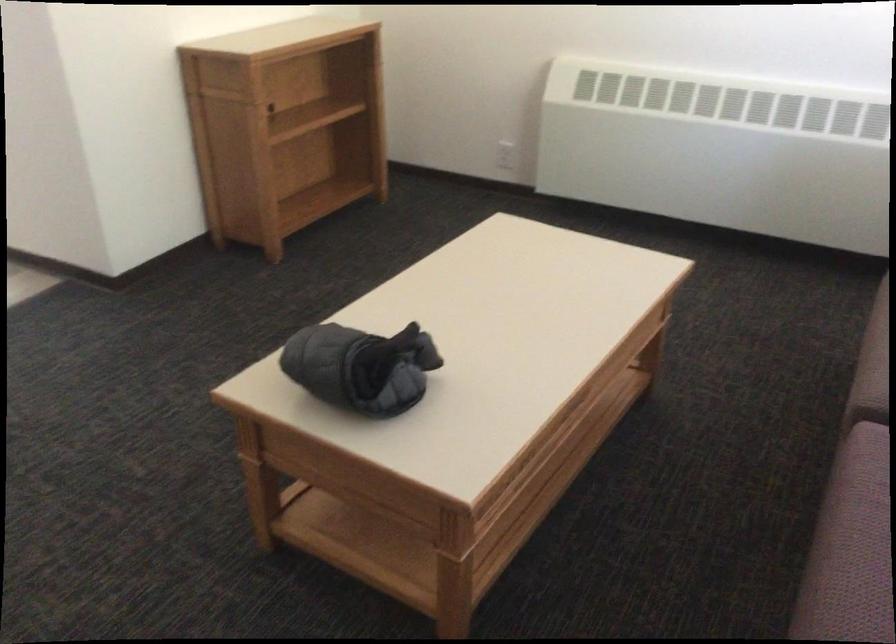
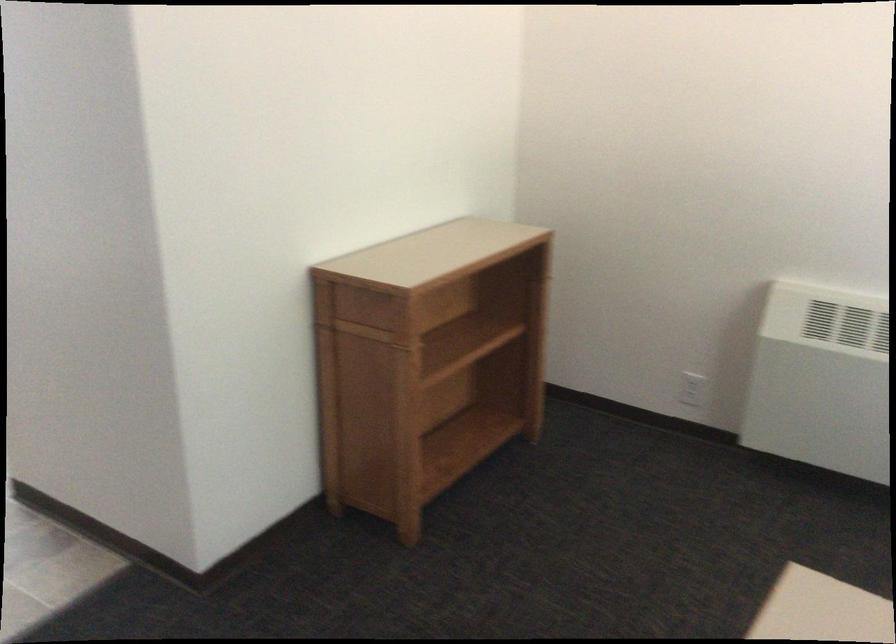
In the second image, find the point that corresponds to pixel 504 156 in the first image.

(692, 389)